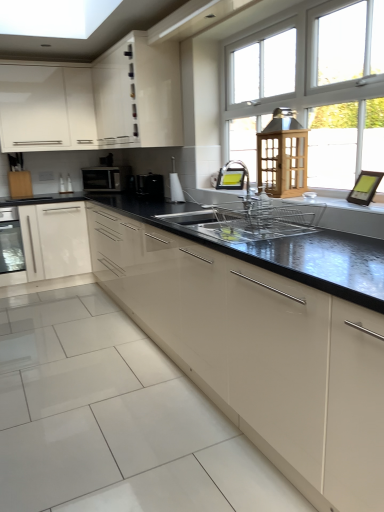
Question: From the image's perspective, would you say black plastic toaster at center, which is the 1th appliance in left-to-right order, is positioned over satin black microwave at upper left?

Choices:
 (A) yes
 (B) no

Answer: (B)

Question: Can you confirm if black plastic toaster at center, which is the 1th appliance in left-to-right order, is thinner than satin black microwave at upper left?

Choices:
 (A) yes
 (B) no

Answer: (A)

Question: Is black plastic toaster at center, which is the 1th appliance in left-to-right order, placed right next to satin black microwave at upper left?

Choices:
 (A) yes
 (B) no

Answer: (B)

Question: Considering the relative sizes of black plastic toaster at center, which is the 2th appliance from front to back, and satin black microwave at upper left in the image provided, is black plastic toaster at center, which is the 2th appliance from front to back, taller than satin black microwave at upper left?

Choices:
 (A) yes
 (B) no

Answer: (B)

Question: Can you confirm if black plastic toaster at center, placed as the 2th appliance when sorted from right to left, is smaller than satin black microwave at upper left?

Choices:
 (A) no
 (B) yes

Answer: (B)

Question: Considering the relative positions of black plastic toaster at center, which is the 2th appliance from front to back, and satin black microwave at upper left in the image provided, is black plastic toaster at center, which is the 2th appliance from front to back, to the left of satin black microwave at upper left from the viewer's perspective?

Choices:
 (A) no
 (B) yes

Answer: (A)

Question: Does satin nickel faucet at center, marked as the first faucet in a back-to-front arrangement, appear on the right side of white glossy cabinet at upper left, the 4th cabinetry when ordered from bottom to top?

Choices:
 (A) yes
 (B) no

Answer: (A)

Question: Does satin nickel faucet at center, marked as the first faucet in a back-to-front arrangement, appear on the left side of white glossy cabinet at upper left, the 4th cabinetry when ordered from bottom to top?

Choices:
 (A) yes
 (B) no

Answer: (B)

Question: From a real-world perspective, does satin nickel faucet at center, marked as the first faucet in a back-to-front arrangement, sit lower than white glossy cabinet at upper left, arranged as the first cabinetry when viewed from the top?

Choices:
 (A) yes
 (B) no

Answer: (A)

Question: Does satin nickel faucet at center, placed as the 2th faucet when sorted from front to back, have a greater height compared to white glossy cabinet at upper left, the 4th cabinetry when ordered from bottom to top?

Choices:
 (A) yes
 (B) no

Answer: (B)

Question: Would you consider satin nickel faucet at center, marked as the first faucet in a back-to-front arrangement, to be distant from white glossy cabinet at upper left, the 4th cabinetry when ordered from bottom to top?

Choices:
 (A) no
 (B) yes

Answer: (B)

Question: Does satin nickel faucet at center, placed as the 2th faucet when sorted from front to back, touch white glossy cabinet at upper left, arranged as the first cabinetry when viewed from the top?

Choices:
 (A) no
 (B) yes

Answer: (A)

Question: Can you confirm if satin nickel faucet at center, marked as the first faucet in a back-to-front arrangement, is smaller than satin black microwave at upper left?

Choices:
 (A) no
 (B) yes

Answer: (B)